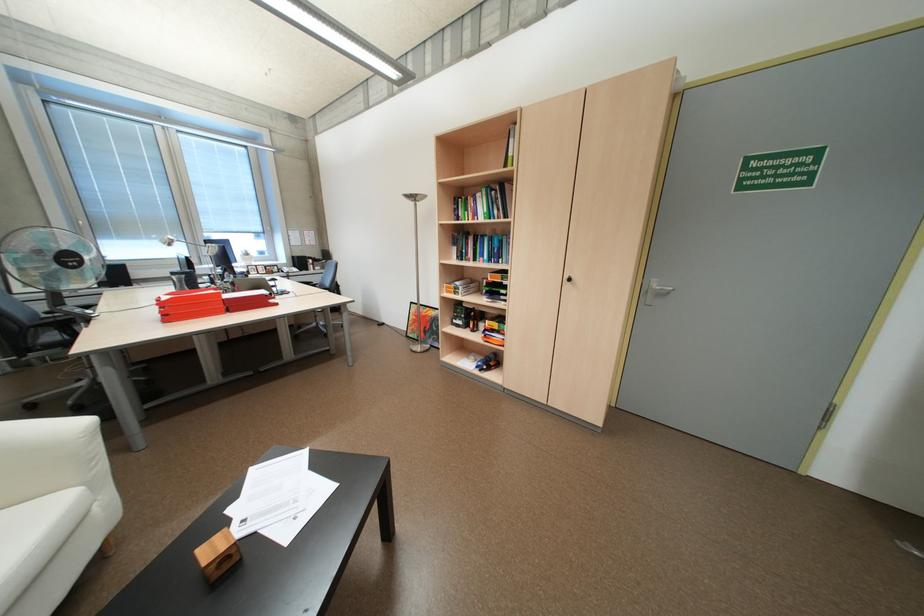
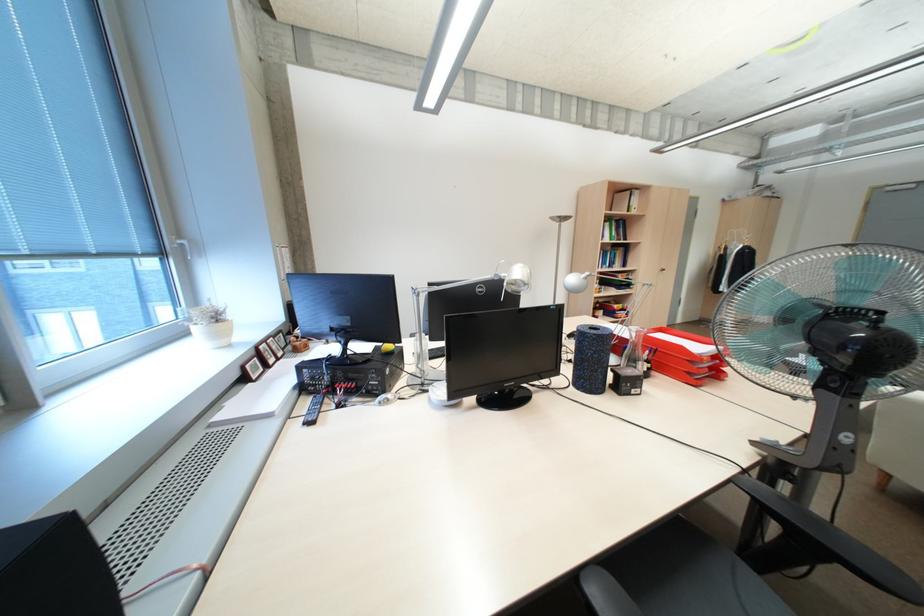
Question: I am providing you with two images of the same scene from different viewpoints. Which of the following objects are not visible in image2?

Choices:
 (A) white paper sheets
 (B) glass blender pitcher handle
 (C) silver desk lamp head
 (D) black fan dial

Answer: (A)